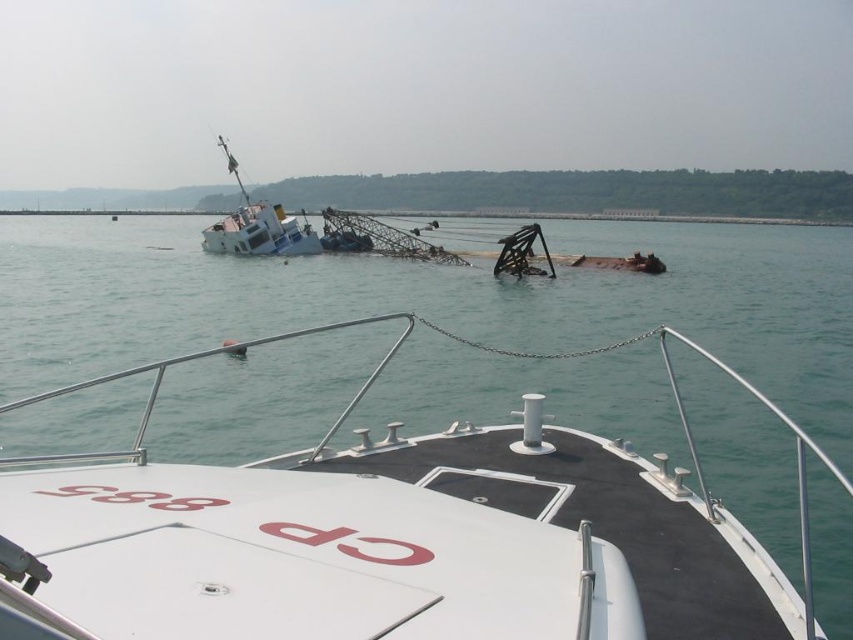
Question: Among these points, which one is farthest from the camera?

Choices:
 (A) (415, 449)
 (B) (219, 237)

Answer: (B)

Question: Is white matte boat at center to the left of white matte ship at left from the viewer's perspective?

Choices:
 (A) no
 (B) yes

Answer: (A)

Question: Which object appears farthest from the camera in this image?

Choices:
 (A) white matte ship at left
 (B) white matte boat at center

Answer: (A)

Question: Does white matte boat at center appear on the left side of white matte ship at left?

Choices:
 (A) yes
 (B) no

Answer: (B)

Question: Can you confirm if white matte boat at center is bigger than white matte ship at left?

Choices:
 (A) yes
 (B) no

Answer: (A)